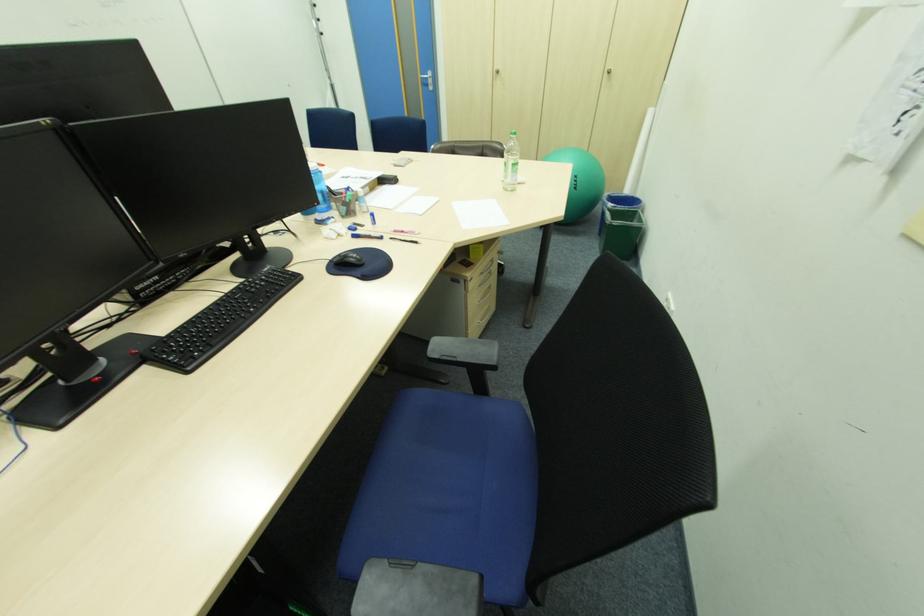
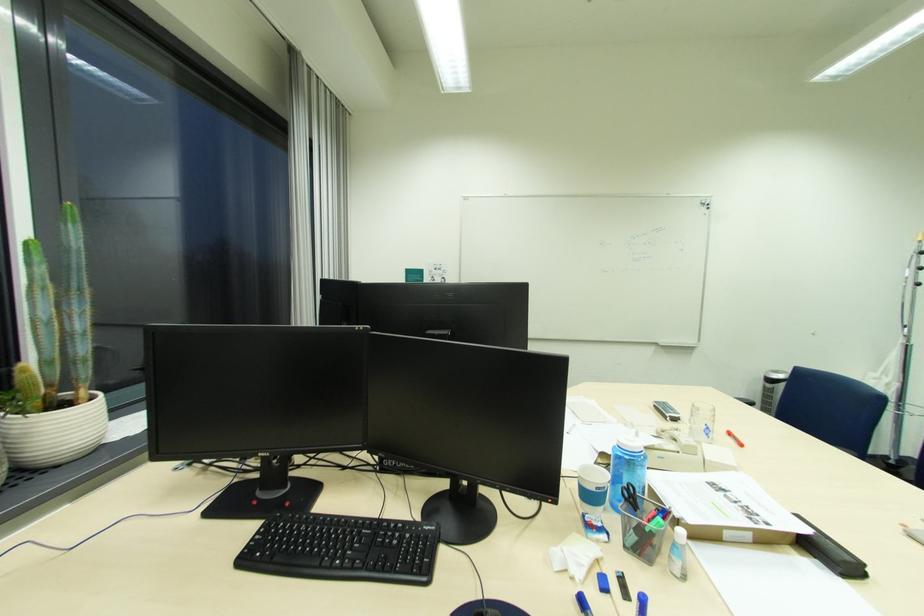
Where in the second image is the point corresponding to point (355, 177) from the first image?

(731, 491)